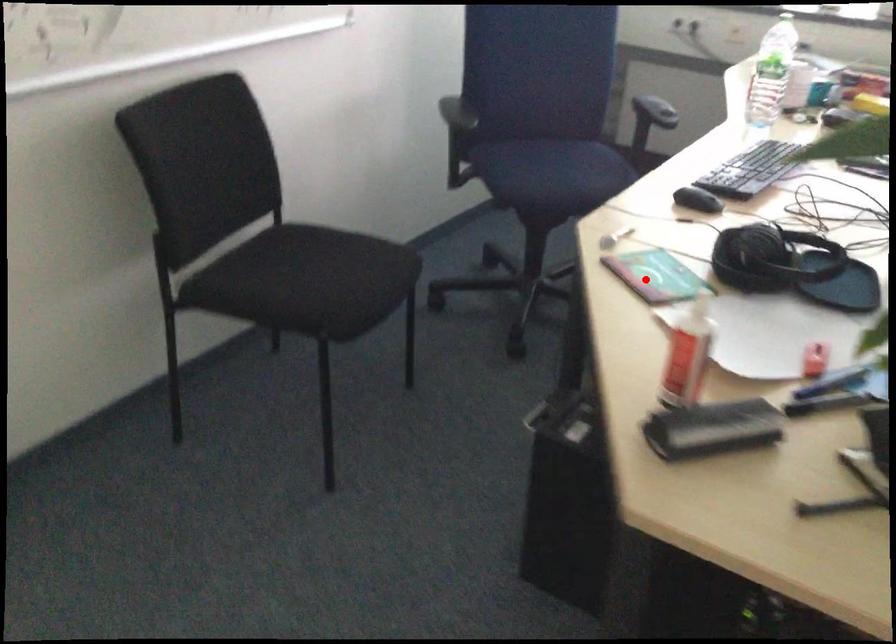
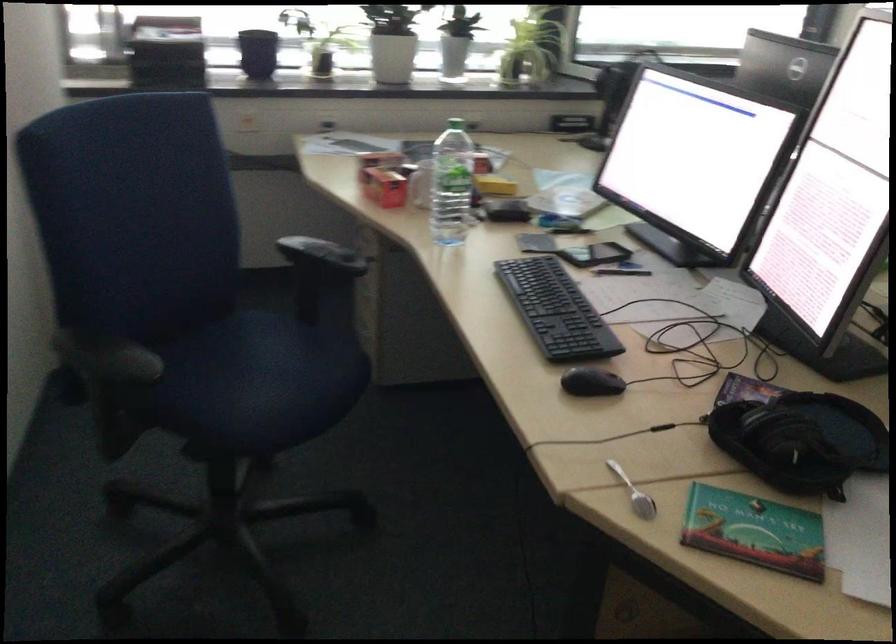
Find the pixel in the second image that matches the highlighted location in the first image.

(754, 531)